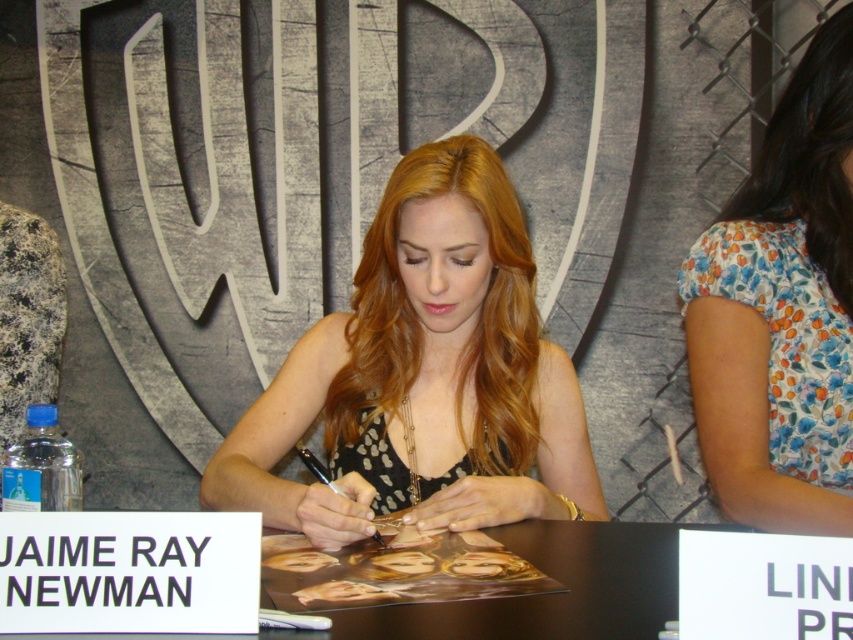
Is matte black dress at center smaller than black paper at center?

Incorrect, matte black dress at center is not smaller in size than black paper at center.

Does matte black dress at center appear under black paper at center?

No.

Is point (430, 381) behind point (6, 586)?

Yes, point (430, 381) is behind point (6, 586).

Find the location of a particular element. Image resolution: width=853 pixels, height=640 pixels. matte black dress at center is located at coordinates coord(422,376).

Is white paper at center to the right of black paper at center from the viewer's perspective?

Indeed, white paper at center is positioned on the right side of black paper at center.

I want to click on white paper at center, so click(552, 593).

Is matte black dress at center taller than floral fabric shirt at right?

Incorrect, matte black dress at center's height is not larger of floral fabric shirt at right's.

Does point (346, 484) come in front of point (817, 260)?

Yes, point (346, 484) is closer to viewer.

At what (x,y) coordinates should I click in order to perform the action: click on matte black dress at center. Please return your answer as a coordinate pair (x, y). Looking at the image, I should click on (422, 376).